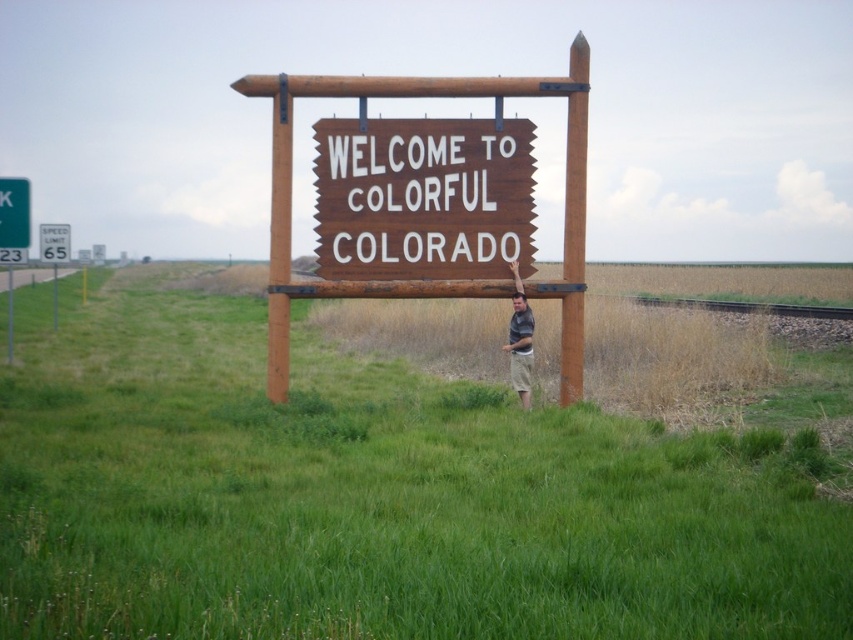
You are a photographer trying to capture a clear shot of the matte gray shirt at center and the brushed metal speed limit sign at left. Which object is positioned higher in the frame?

The matte gray shirt at center is much taller than the brushed metal speed limit sign at left, so it is positioned higher in the frame.

You are taking a photo of the brown wooden sign at center and the matte gray shirt at center. Which object is closer to the camera?

The brown wooden sign at center is closer to the camera than the matte gray shirt at center.

You are planning to take a photo of the brown wooden sign at center and the green grassy field at center. Since you want to capture both objects clearly, which one should you focus on first to ensure sharpness?

The green grassy field at center is larger in size than the brown wooden sign at center, so focusing on the larger object first would help ensure both are in focus as the depth of field might be sufficient to cover both.